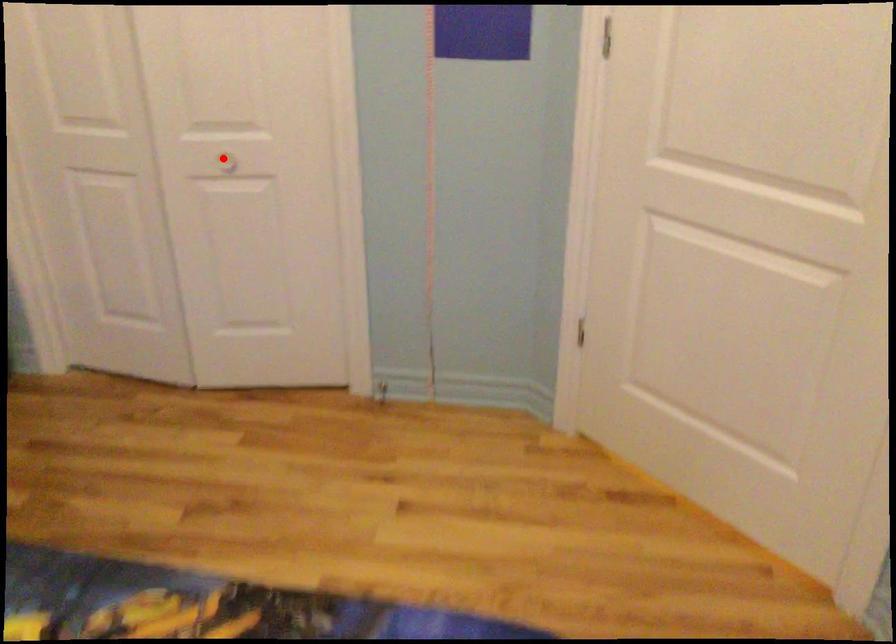
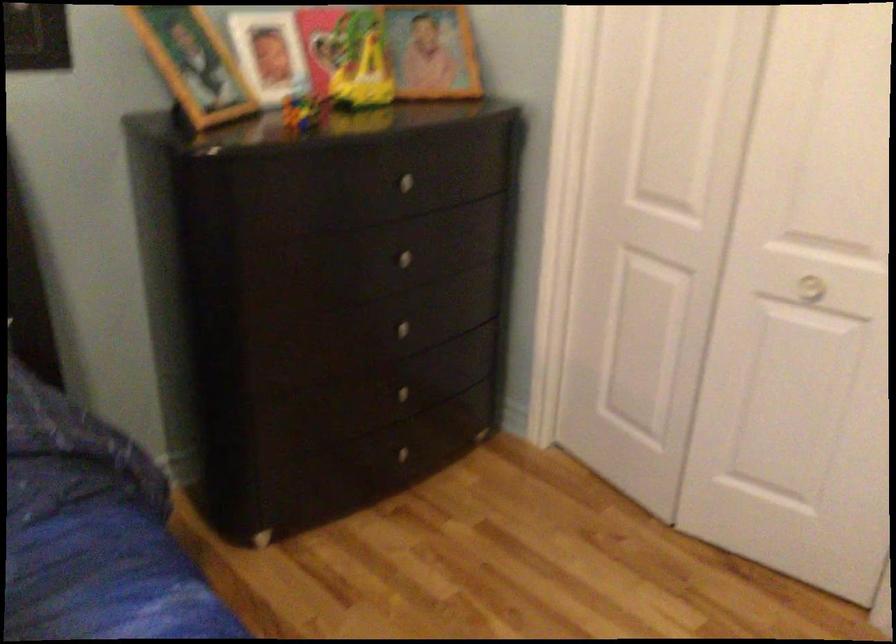
Find the pixel in the second image that matches the highlighted location in the first image.

(810, 288)